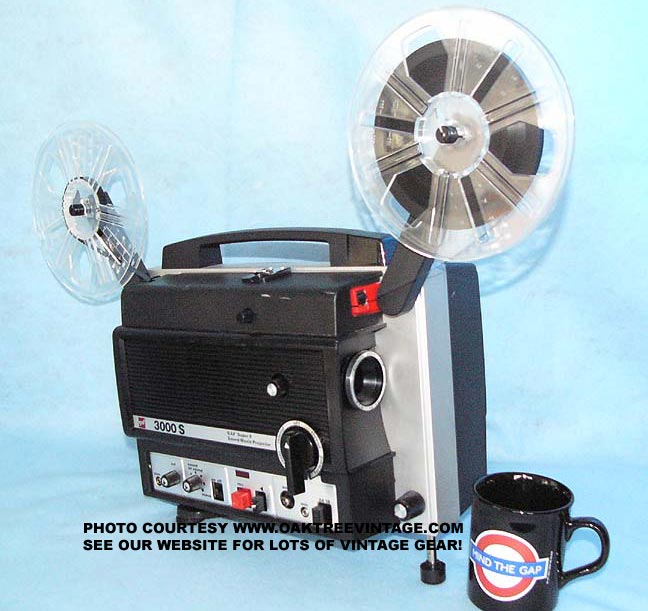
At what (x,y) coordinates should I click in order to perform the action: click on coffee mug. Please return your answer as a coordinate pair (x, y). Image resolution: width=648 pixels, height=611 pixels. Looking at the image, I should click on (548, 519).